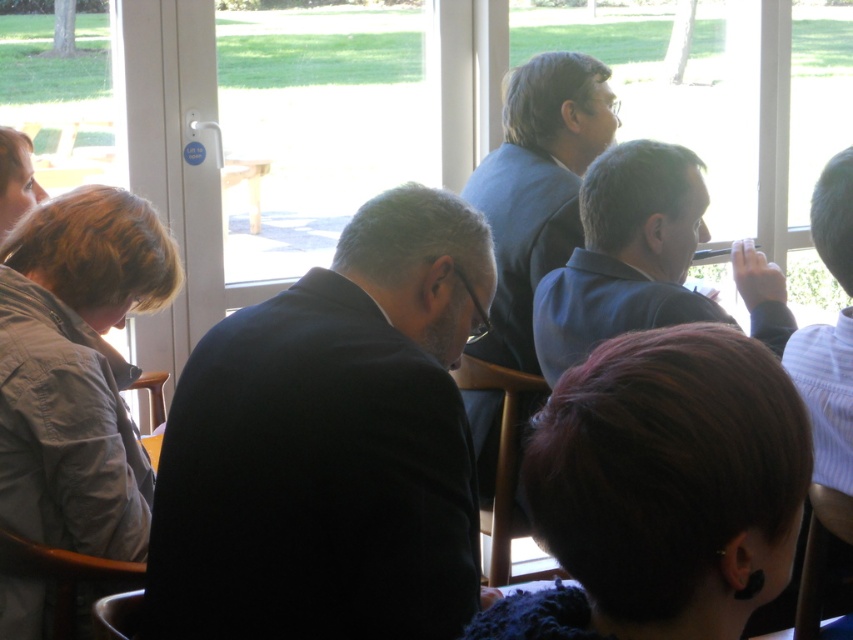
Question: Which point is farther to the camera?

Choices:
 (A) (636, 444)
 (B) (514, 177)
 (C) (849, 212)

Answer: (B)

Question: Can you confirm if dark suit at center is wider than blue fabric shirt at right?

Choices:
 (A) yes
 (B) no

Answer: (B)

Question: Is dark suit at center above dark brown hair at lower right?

Choices:
 (A) no
 (B) yes

Answer: (B)

Question: Is blue suit at center bigger than white striped shirt at right?

Choices:
 (A) no
 (B) yes

Answer: (B)

Question: Which of the following is the farthest from the observer?

Choices:
 (A) (831, 205)
 (B) (672, 522)

Answer: (A)

Question: Among these points, which one is nearest to the camera?

Choices:
 (A) (630, 221)
 (B) (683, 352)

Answer: (B)